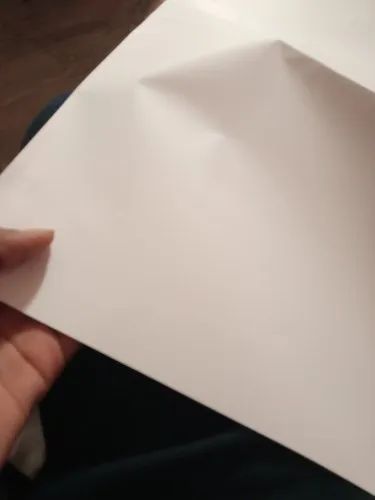
This screenshot has width=375, height=500. Identify the location of hardwood floor. [63, 61].